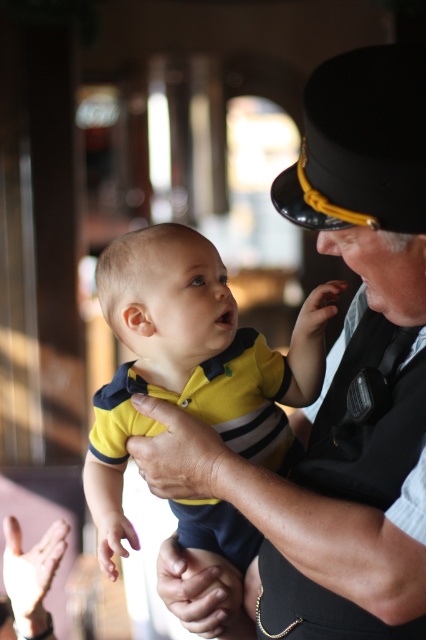
Does matte black uniform at center have a greater height compared to black leather vest at center?

Yes.

Between matte black uniform at center and black leather vest at center, which one appears on the left side from the viewer's perspective?

From the viewer's perspective, matte black uniform at center appears more on the left side.

Who is more forward, [417,198] or [394,486]?

Point [417,198]

I want to click on matte black uniform at center, so click(339, 374).

Who is positioned more to the left, yellow matte shirt at center or black leather vest at center?

From the viewer's perspective, yellow matte shirt at center appears more on the left side.

This screenshot has width=426, height=640. Identify the location of yellow matte shirt at center. (189, 362).

Describe the element at coordinates (339, 374) in the screenshot. Image resolution: width=426 pixels, height=640 pixels. I see `matte black uniform at center` at that location.

Does matte black uniform at center appear under yellow matte shirt at center?

No.

Is point (316, 625) less distant than point (101, 268)?

Yes.

Where is `matte black uniform at center`? This screenshot has height=640, width=426. matte black uniform at center is located at coordinates (339, 374).